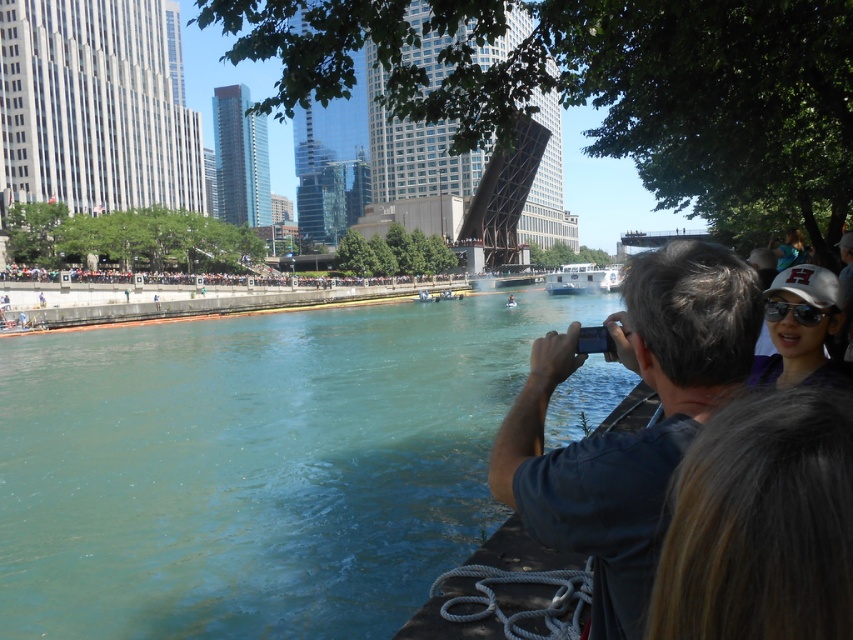
You are a photographer standing at the center of the scene. You want to capture a photo of the person with dark brown hair at upper right. Based on their position, in which direction should you move your camera to frame them properly?

Since the person with dark brown hair at upper right is located at point 0.819 on the x axis and 0.893 on the y axis, you should move your camera slightly to the right and upwards to frame them properly.

From the picture: You are standing at the center of the image and want to take a photo of the teal water at lower left. In which direction should you move to get closer to it?

The teal water at lower left is located at point 0.730 on the x axis and 0.300 on the y axis. Since you are at the center, you should move towards the lower left direction to get closer to it.

You are a photographer trying to capture the white matte baseball cap at upper right and the white matte boat at center in the same frame. Which object will appear narrower in the photo?

The white matte baseball cap at upper right will appear narrower in the photo because it is thinner than the white matte boat at center.